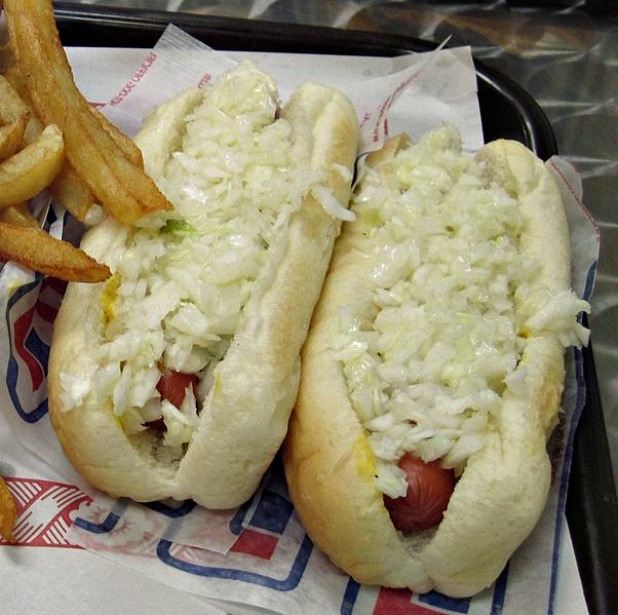
The width and height of the screenshot is (618, 615). I want to click on tray paper towel/napkin, so click(69, 585).